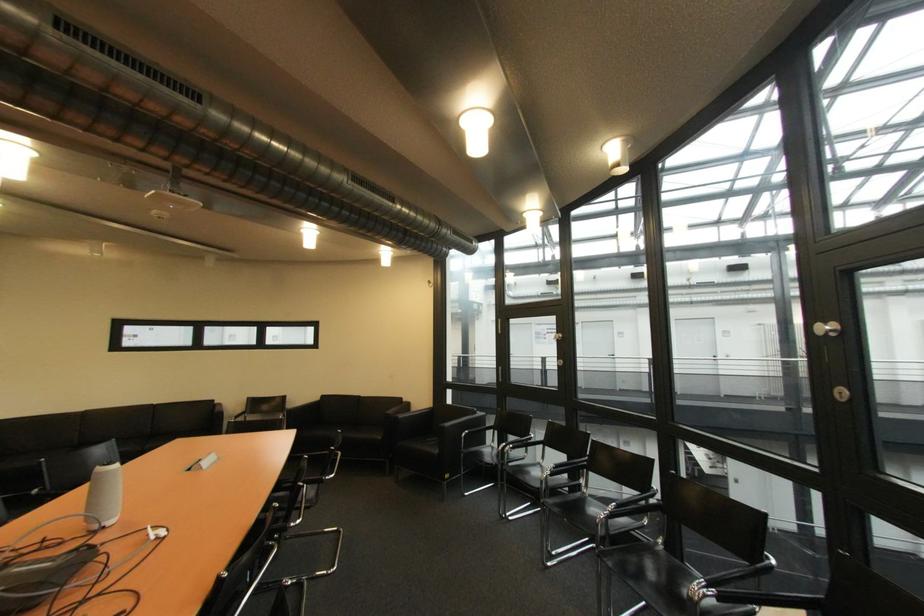
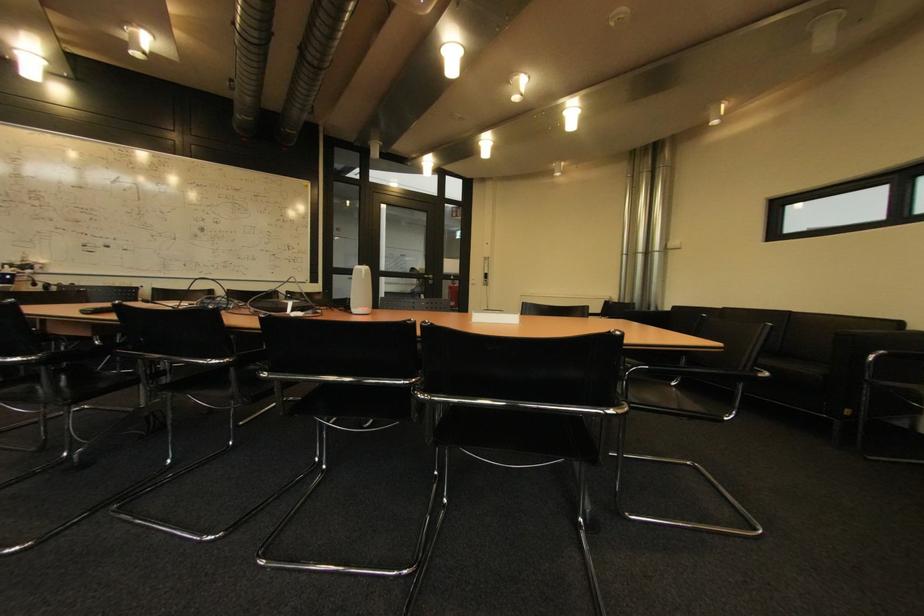
Where in the second image is the point corresponding to [113,529] from the first image?

(359, 314)